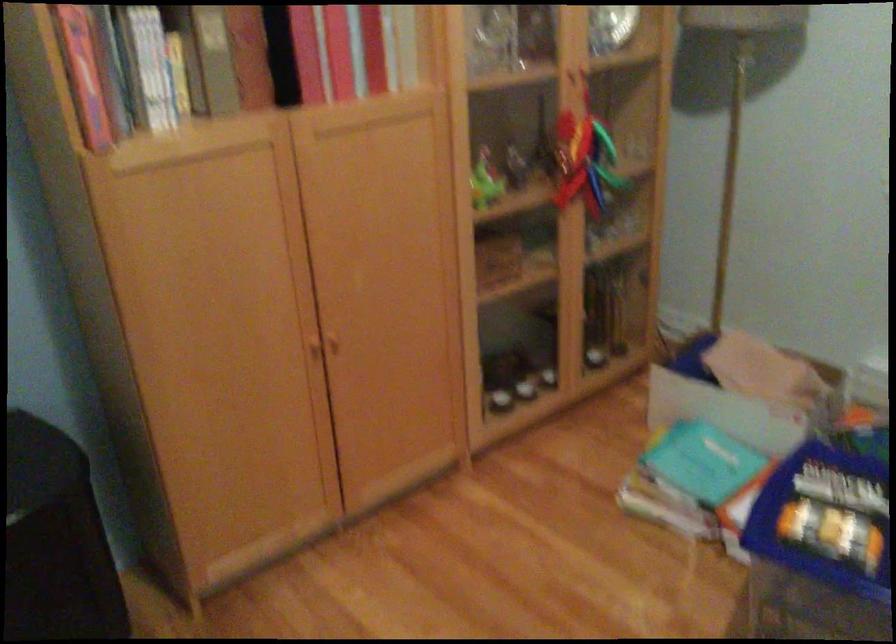
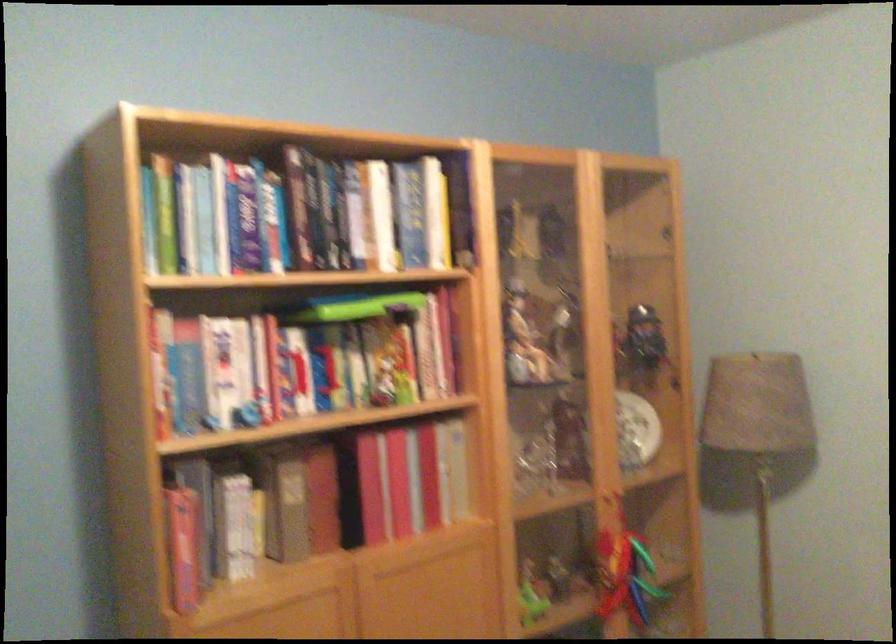
Question: How did the camera likely rotate?

Choices:
 (A) Left
 (B) Right
 (C) Up
 (D) Down

Answer: (C)